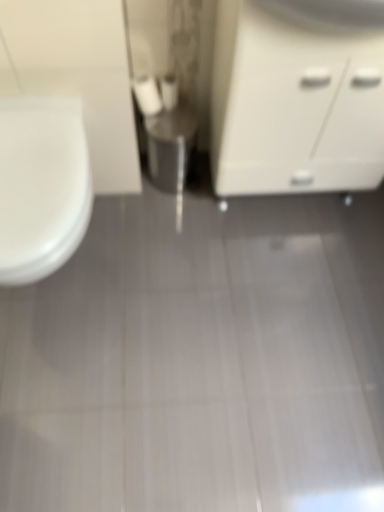
Locate an element on the screen. The height and width of the screenshot is (512, 384). vacant area that lies in front of white matte cabinet at right is located at coordinates (281, 277).